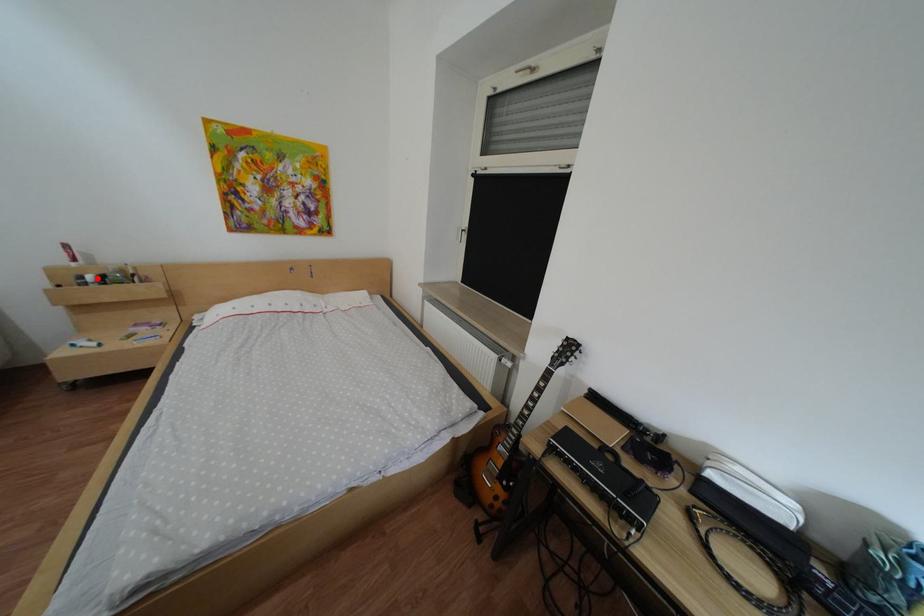
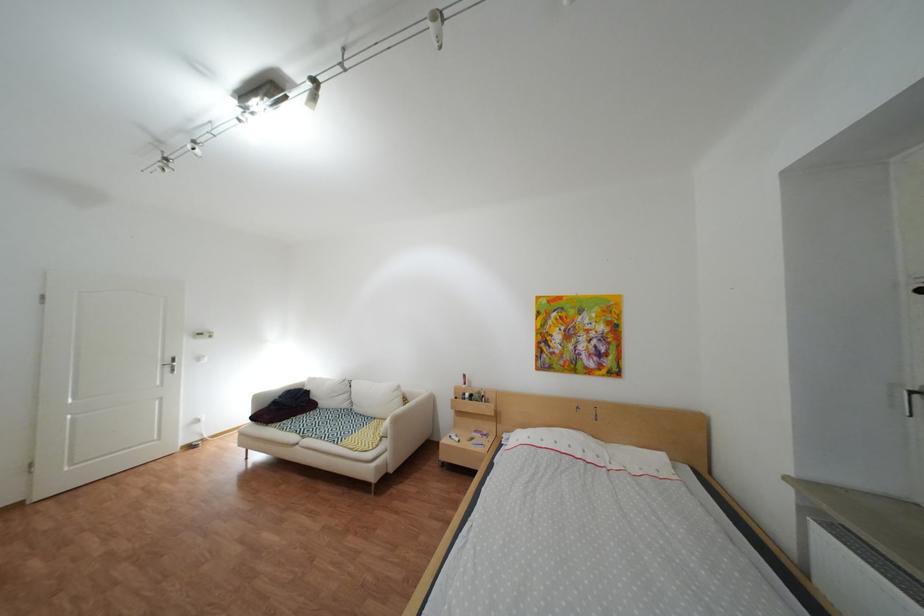
The point at the highlighted location is marked in the first image. Where is the corresponding point in the second image?

(480, 395)